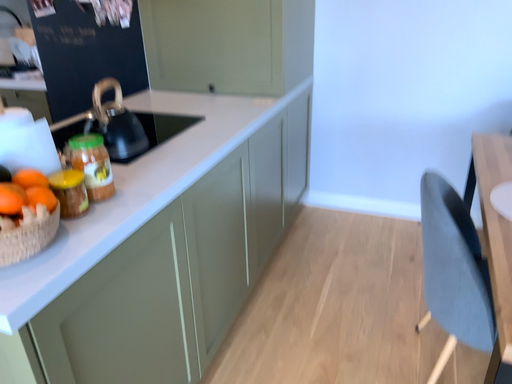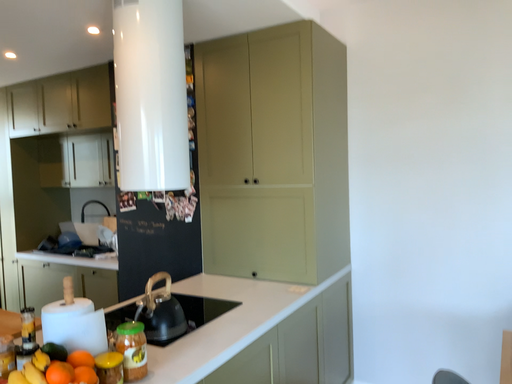
Question: Which way did the camera rotate in the video?

Choices:
 (A) rotated downward
 (B) rotated upward

Answer: (B)